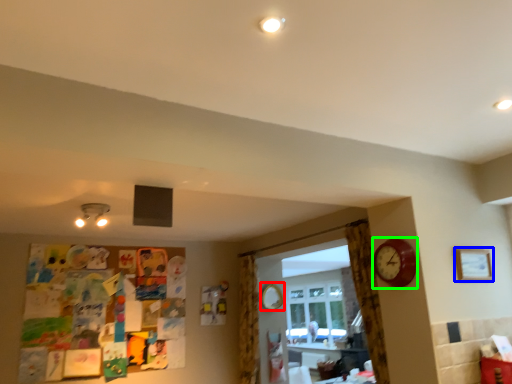
Question: Which object is the farthest from mirror (highlighted by a red box)? Choose among these: picture frame (highlighted by a blue box) or clock (highlighted by a green box).

Choices:
 (A) picture frame
 (B) clock

Answer: (A)